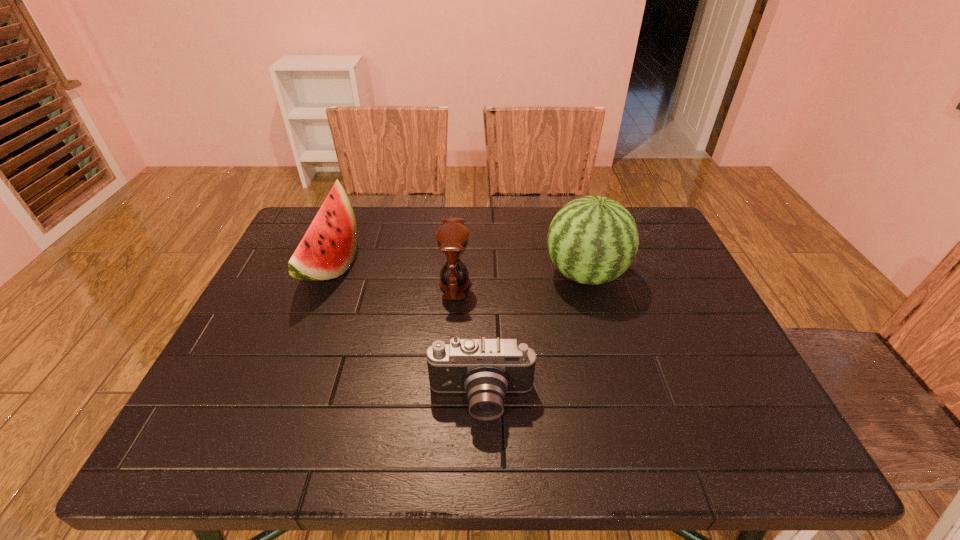
Identify the location of the taller watermelon. (592, 240).

Identify the location of the right watermelon. The image size is (960, 540). (592, 240).

Find the location of `the left watermelon`. the left watermelon is located at coordinates (328, 248).

At what (x,y) coordinates should I click in order to perform the action: click on the leftmost object. Please return your answer as a coordinate pair (x, y). This screenshot has width=960, height=540. Looking at the image, I should click on (328, 248).

Locate an element on the screen. This screenshot has width=960, height=540. hourglass is located at coordinates (452, 238).

Find the location of `camera`. camera is located at coordinates (485, 369).

You are a GUI agent. You are given a task and a screenshot of the screen. Output one action in this format:
    pyautogui.click(x=<x>, y=<y>)
    Task: Click on the nearest object
    Image resolution: width=960 pixels, height=540 pixels.
    Given the screenshot: What is the action you would take?
    pyautogui.click(x=485, y=369)

You are a GUI agent. You are given a task and a screenshot of the screen. Output one action in this format:
    pyautogui.click(x=<x>, y=<y>)
    Task: Click on the free region located 0.090m on the left of the right watermelon
    Image resolution: width=960 pixels, height=540 pixels.
    Given the screenshot: What is the action you would take?
    pyautogui.click(x=511, y=274)

Find the location of a particular element. The image size is (960, 540). vacant space located on the outer rind of the left watermelon is located at coordinates (387, 266).

What are the coordinates of `vacant region located 0.130m on the back of the hourglass` in the screenshot? It's located at (458, 239).